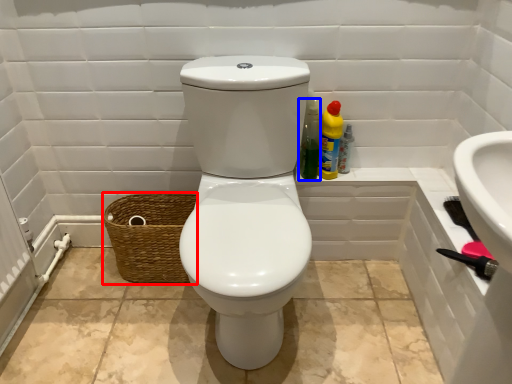
Question: Which object appears farthest to the camera in this image, basket (highlighted by a red box) or cleaning product (highlighted by a blue box)?

Choices:
 (A) basket
 (B) cleaning product

Answer: (A)